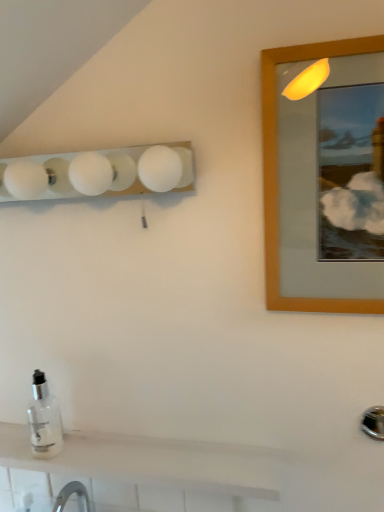
Where is `white frosted glass light fixture at upper left`? white frosted glass light fixture at upper left is located at coordinates (99, 173).

In order to face clear glass bottle at lower left, should I rotate leftwards or rightwards?

A 19.225 degree turn to the left will do.

Where is `white glossy tile at lower left`? The height and width of the screenshot is (512, 384). white glossy tile at lower left is located at coordinates (31, 490).

The height and width of the screenshot is (512, 384). What are the coordinates of `white frosted glass light fixture at upper left` in the screenshot? It's located at (99, 173).

From the image's perspective, is clear glass bottle at lower left below white frosted glass light fixture at upper left?

Indeed, from the image's perspective, clear glass bottle at lower left is shown beneath white frosted glass light fixture at upper left.

In the scene shown: Is clear glass bottle at lower left at the left side of white frosted glass light fixture at upper left?

Indeed, clear glass bottle at lower left is positioned on the left side of white frosted glass light fixture at upper left.

Looking at this image, is clear glass bottle at lower left smaller than white frosted glass light fixture at upper left?

Correct, clear glass bottle at lower left occupies less space than white frosted glass light fixture at upper left.

Would you say white frosted glass light fixture at upper left is part of clear glass bottle at lower left's contents?

No.

Can you tell me how much wooden-framed mirror at upper right and clear glass bottle at lower left differ in facing direction?

0.0149 degrees separate the facing orientations of wooden-framed mirror at upper right and clear glass bottle at lower left.

Can you confirm if wooden-framed mirror at upper right is shorter than clear glass bottle at lower left?

Incorrect, the height of wooden-framed mirror at upper right does not fall short of that of clear glass bottle at lower left.

Which is correct: wooden-framed mirror at upper right is inside clear glass bottle at lower left, or outside of it?

wooden-framed mirror at upper right is not inside clear glass bottle at lower left, it's outside.

Considering the sizes of objects wooden-framed mirror at upper right and clear glass bottle at lower left in the image provided, who is bigger, wooden-framed mirror at upper right or clear glass bottle at lower left?

With larger size is wooden-framed mirror at upper right.

Considering the relative sizes of white frosted glass light fixture at upper left and clear glass bottle at lower left in the image provided, is white frosted glass light fixture at upper left thinner than clear glass bottle at lower left?

In fact, white frosted glass light fixture at upper left might be wider than clear glass bottle at lower left.

Consider the image. Is white frosted glass light fixture at upper left taller than clear glass bottle at lower left?

No, white frosted glass light fixture at upper left is not taller than clear glass bottle at lower left.

Considering the positions of point (26, 170) and point (37, 392), is point (26, 170) closer or farther from the camera than point (37, 392)?

Point (26, 170).

Which is behind, white frosted glass light fixture at upper left or clear glass bottle at lower left?

clear glass bottle at lower left is more distant.

From the image's perspective, is wooden-framed mirror at upper right beneath white glossy tile at lower left?

No, from the image's perspective, wooden-framed mirror at upper right is not below white glossy tile at lower left.

Is wooden-framed mirror at upper right looking in the opposite direction of white glossy tile at lower left?

No, wooden-framed mirror at upper right is not facing away from white glossy tile at lower left.

Choose the correct answer: Is wooden-framed mirror at upper right inside white glossy tile at lower left or outside it?

wooden-framed mirror at upper right is located beyond the bounds of white glossy tile at lower left.

Is clear glass bottle at lower left directly adjacent to white glossy tile at lower left?

No.

Considering the sizes of clear glass bottle at lower left and white glossy tile at lower left in the image, is clear glass bottle at lower left taller or shorter than white glossy tile at lower left?

clear glass bottle at lower left is taller than white glossy tile at lower left.

I want to click on bottle that is above the white glossy tile at lower left (from the image's perspective), so click(x=44, y=420).

Considering the sizes of objects clear glass bottle at lower left and white glossy tile at lower left in the image provided, who is smaller, clear glass bottle at lower left or white glossy tile at lower left?

Smaller between the two is white glossy tile at lower left.

Between white glossy tile at lower left and wooden-framed mirror at upper right, which one has more height?

With more height is wooden-framed mirror at upper right.

Which is behind, white glossy tile at lower left or wooden-framed mirror at upper right?

white glossy tile at lower left.

From the picture: Considering the relative positions of white glossy tile at lower left and wooden-framed mirror at upper right in the image provided, is white glossy tile at lower left to the right of wooden-framed mirror at upper right from the viewer's perspective?

In fact, white glossy tile at lower left is to the left of wooden-framed mirror at upper right.

Looking at this image, how different are the orientations of white glossy tile at lower left and wooden-framed mirror at upper right in degrees?

They differ by 0.0094 degrees in their facing directions.

From the image's perspective, which object appears higher, wooden-framed mirror at upper right or white frosted glass light fixture at upper left?

From the image's view, white frosted glass light fixture at upper left is above.

How different are the orientations of wooden-framed mirror at upper right and white frosted glass light fixture at upper left in degrees?

wooden-framed mirror at upper right and white frosted glass light fixture at upper left are facing 0.00148 degrees away from each other.

Are wooden-framed mirror at upper right and white frosted glass light fixture at upper left beside each other?

wooden-framed mirror at upper right and white frosted glass light fixture at upper left are not in contact.

Consider the image. Is white frosted glass light fixture at upper left inside wooden-framed mirror at upper right?

No, white frosted glass light fixture at upper left is not inside wooden-framed mirror at upper right.

In the image, there is a white frosted glass light fixture at upper left. At what (x,y) coordinates should I click in order to perform the action: click on bottle below it (from the image's perspective). Please return your answer as a coordinate pair (x, y). This screenshot has height=512, width=384. Looking at the image, I should click on (44, 420).

Identify the location of mirror above the clear glass bottle at lower left (from a real-world perspective). The width and height of the screenshot is (384, 512). (328, 180).

From the image, which object appears to be nearer to white glossy tile at lower left, wooden-framed mirror at upper right or clear glass bottle at lower left?

Among the two, clear glass bottle at lower left is located nearer to white glossy tile at lower left.

Considering their positions, is clear glass bottle at lower left positioned further to white frosted glass light fixture at upper left than white glossy tile at lower left?

Based on the image, white glossy tile at lower left appears to be further to white frosted glass light fixture at upper left.

Considering their positions, is wooden-framed mirror at upper right positioned closer to white glossy tile at lower left than white frosted glass light fixture at upper left?

Based on the image, white frosted glass light fixture at upper left appears to be nearer to white glossy tile at lower left.

Looking at the image, which one is located closer to wooden-framed mirror at upper right, white glossy tile at lower left or white frosted glass light fixture at upper left?

Based on the image, white frosted glass light fixture at upper left appears to be nearer to wooden-framed mirror at upper right.

Which object lies further to the anchor point wooden-framed mirror at upper right, clear glass bottle at lower left or white glossy tile at lower left?

white glossy tile at lower left lies further to wooden-framed mirror at upper right than the other object.

Looking at this image, from the image, which object appears to be nearer to white frosted glass light fixture at upper left, white glossy tile at lower left or wooden-framed mirror at upper right?

wooden-framed mirror at upper right.

Based on their spatial positions, is white frosted glass light fixture at upper left or wooden-framed mirror at upper right closer to white glossy tile at lower left?

white frosted glass light fixture at upper left is positioned closer to the anchor white glossy tile at lower left.

When comparing their distances from clear glass bottle at lower left, does white frosted glass light fixture at upper left or white glossy tile at lower left seem closer?

white glossy tile at lower left lies closer to clear glass bottle at lower left than the other object.

Where is `bottle between white frosted glass light fixture at upper left and white glossy tile at lower left from top to bottom`? The width and height of the screenshot is (384, 512). bottle between white frosted glass light fixture at upper left and white glossy tile at lower left from top to bottom is located at coordinates (44, 420).

Identify the location of lamp located between clear glass bottle at lower left and wooden-framed mirror at upper right in the left-right direction. [99, 173].

At what (x,y) coordinates should I click in order to perform the action: click on mirror between white frosted glass light fixture at upper left and white glossy tile at lower left in the up-down direction. Please return your answer as a coordinate pair (x, y). The width and height of the screenshot is (384, 512). Looking at the image, I should click on (328, 180).

At what (x,y) coordinates should I click in order to perform the action: click on bottle between white glossy tile at lower left and wooden-framed mirror at upper right in the horizontal direction. Please return your answer as a coordinate pair (x, y). This screenshot has width=384, height=512. Looking at the image, I should click on (44, 420).